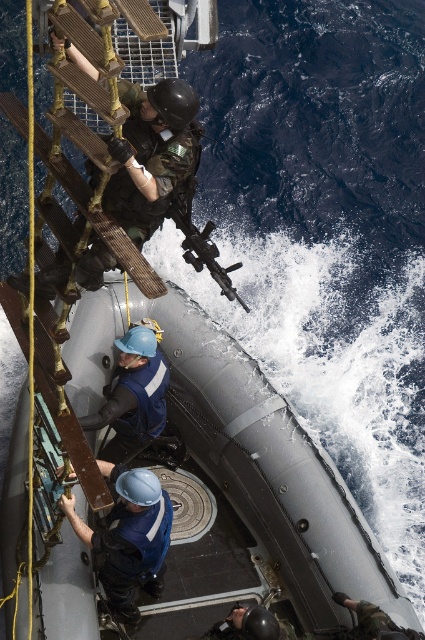
Question: Does matte black rifle at center have a lesser width compared to shiny black helmet at lower center?

Choices:
 (A) no
 (B) yes

Answer: (A)

Question: Among these objects, which one is farthest from the camera?

Choices:
 (A) blue hard hat at center
 (B) matte black rifle at center

Answer: (B)

Question: Can you confirm if blue hard hat at center is positioned to the left of shiny black helmet at lower center?

Choices:
 (A) yes
 (B) no

Answer: (A)

Question: Among these points, which one is farthest from the camera?

Choices:
 (A) (118, 522)
 (B) (223, 289)

Answer: (B)

Question: Which object is the closest to the blue hard hat at center?

Choices:
 (A) shiny black helmet at lower center
 (B) matte black rifle at center

Answer: (A)

Question: Is blue hard hat at center to the right of matte black rifle at center from the viewer's perspective?

Choices:
 (A) no
 (B) yes

Answer: (A)